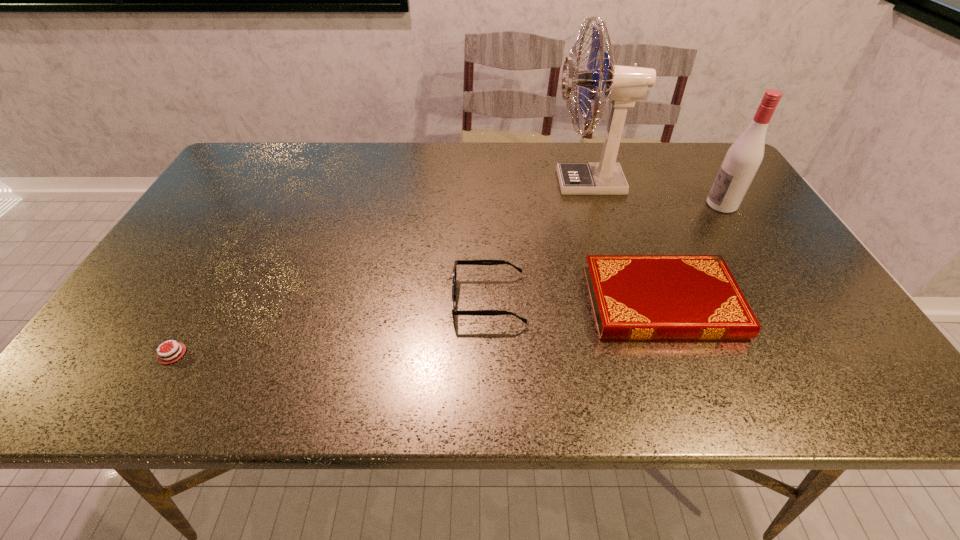
Locate an element on the screen. The height and width of the screenshot is (540, 960). fan is located at coordinates (624, 85).

Identify the location of the rightmost object. The width and height of the screenshot is (960, 540). (744, 157).

At what (x,y) coordinates should I click in order to perform the action: click on the second tallest object. Please return your answer as a coordinate pair (x, y). Image resolution: width=960 pixels, height=540 pixels. Looking at the image, I should click on (744, 157).

This screenshot has height=540, width=960. What are the coordinates of `the third shortest object` in the screenshot? It's located at (457, 262).

This screenshot has width=960, height=540. What are the coordinates of `sunglasses` in the screenshot? It's located at (457, 262).

Where is `the fourth tallest object`? the fourth tallest object is located at coordinates (634, 297).

The width and height of the screenshot is (960, 540). I want to click on the shortest object, so click(x=168, y=358).

Locate an element on the screen. chocolate cake is located at coordinates (168, 358).

At what (x,y) coordinates should I click in order to perform the action: click on blank space located on the front-facing side of the fan. Please return your answer as a coordinate pair (x, y). The image size is (960, 540). Looking at the image, I should click on pos(485,183).

You are a GUI agent. You are given a task and a screenshot of the screen. Output one action in this format:
    pyautogui.click(x=<x>, y=<y>)
    Task: Click on the vacant region located on the front-facing side of the fan
    Image resolution: width=960 pixels, height=540 pixels.
    Given the screenshot: What is the action you would take?
    pyautogui.click(x=422, y=183)